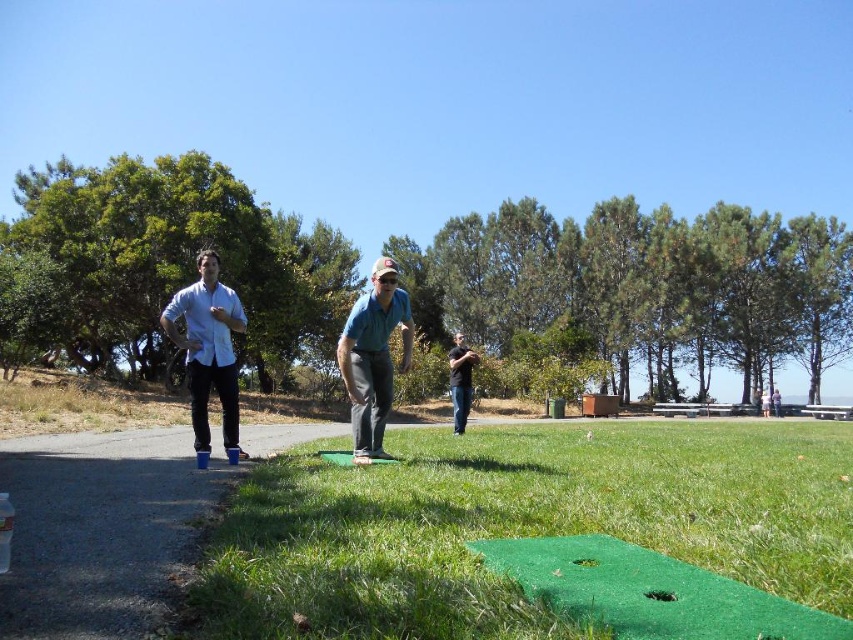
Question: Can you confirm if green artificial turf at center is smaller than green fabric cap at center?

Choices:
 (A) no
 (B) yes

Answer: (A)

Question: Which of these objects is positioned closest to the green artificial turf at center?

Choices:
 (A) white matte shirt at center
 (B) green fabric cap at center

Answer: (B)

Question: Which point is closer to the camera taking this photo?

Choices:
 (A) (764, 499)
 (B) (223, 332)
 (C) (463, 408)

Answer: (A)

Question: Can you confirm if white matte shirt at center is thinner than black matte shirt at center?

Choices:
 (A) no
 (B) yes

Answer: (A)

Question: Which of the following is the closest to the observer?

Choices:
 (A) (372, 321)
 (B) (210, 301)
 (C) (450, 374)
 (D) (647, 476)

Answer: (D)

Question: Can you confirm if green artificial turf at center is thinner than green fabric cap at center?

Choices:
 (A) yes
 (B) no

Answer: (B)